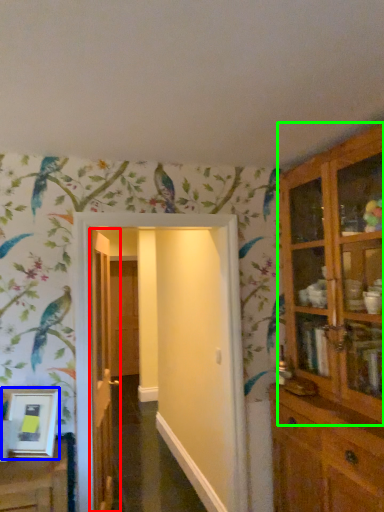
Question: Estimate the real-world distances between objects in this image. Which object is farther from door (highlighted by a red box), picture frame (highlighted by a blue box) or cupboard (highlighted by a green box)?

Choices:
 (A) picture frame
 (B) cupboard

Answer: (B)